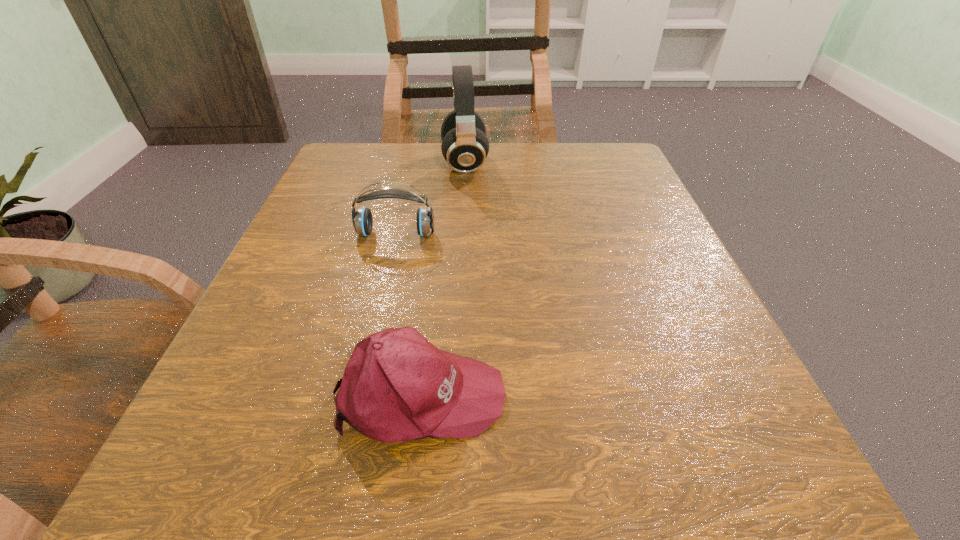
Locate an element on the screen. The height and width of the screenshot is (540, 960). headset present at the left edge is located at coordinates (362, 220).

This screenshot has width=960, height=540. What are the coordinates of `baseball cap present at the left edge` in the screenshot? It's located at (397, 386).

Where is `object positioned at the near left corner`? The image size is (960, 540). object positioned at the near left corner is located at coordinates (397, 386).

In the image, there is a desktop. Where is `free space at the far edge`? This screenshot has width=960, height=540. free space at the far edge is located at coordinates (541, 165).

In the image, there is a desktop. Identify the location of vacant space at the near edge. The height and width of the screenshot is (540, 960). coord(633,447).

Image resolution: width=960 pixels, height=540 pixels. In the image, there is a desktop. What are the coordinates of `free space at the left edge` in the screenshot? It's located at (326, 245).

In the image, there is a desktop. At what (x,y) coordinates should I click in order to perform the action: click on vacant space at the right edge. Please return your answer as a coordinate pair (x, y). The height and width of the screenshot is (540, 960). Looking at the image, I should click on (665, 299).

The height and width of the screenshot is (540, 960). Identify the location of free location at the far left corner. (390, 187).

At what (x,y) coordinates should I click in order to perform the action: click on free space at the near left corner of the desktop. Please return your answer as a coordinate pair (x, y). The width and height of the screenshot is (960, 540). Looking at the image, I should click on (295, 452).

Locate an element on the screen. Image resolution: width=960 pixels, height=540 pixels. vacant space at the far right corner of the desktop is located at coordinates (593, 145).